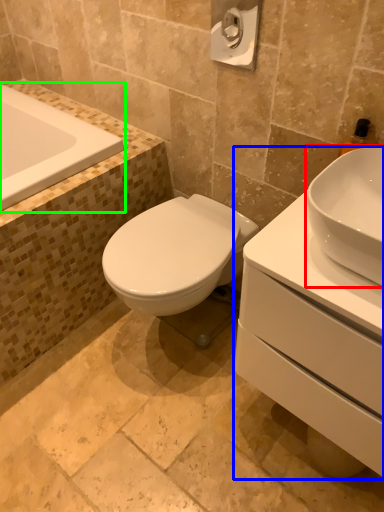
Question: Which object is positioned closest to sink (highlighted by a red box)? Select from porcelain (highlighted by a blue box) and bathtub (highlighted by a green box).

Choices:
 (A) porcelain
 (B) bathtub

Answer: (A)